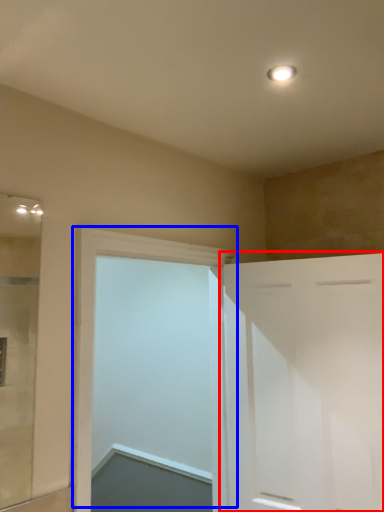
Question: Which of the following is the closest to the observer, door (highlighted by a red box) or door (highlighted by a blue box)?

Choices:
 (A) door
 (B) door

Answer: (B)